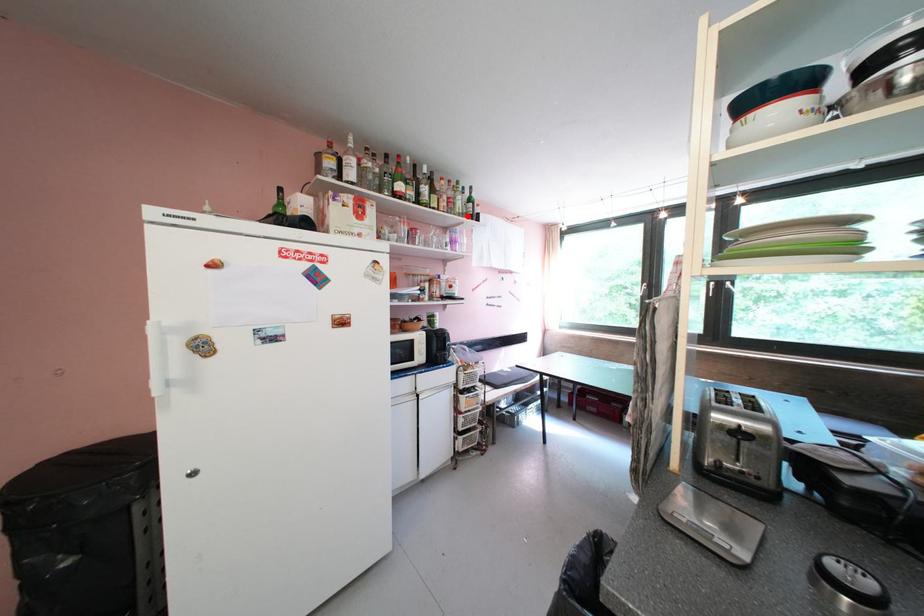
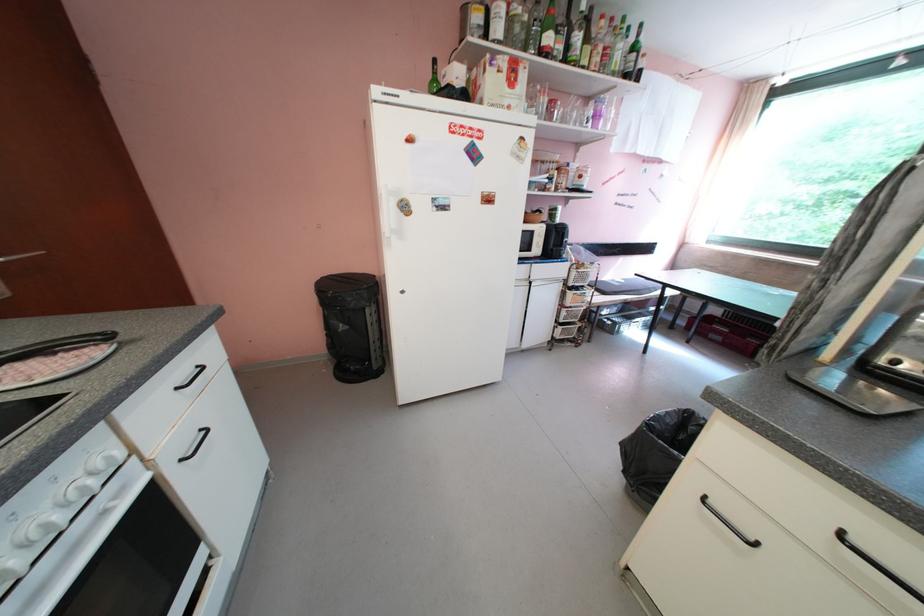
The point at the highlighted location is marked in the first image. Where is the corresponding point in the second image?

(622, 75)